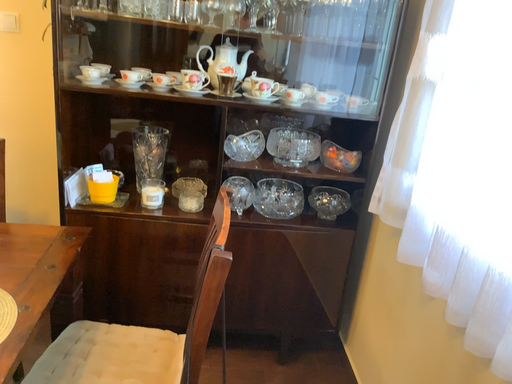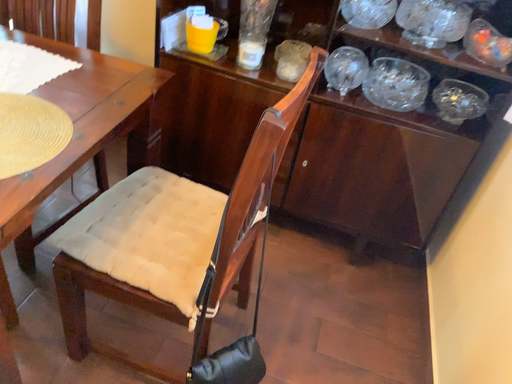
Question: Which way did the camera rotate in the video?

Choices:
 (A) rotated upward
 (B) rotated downward

Answer: (B)